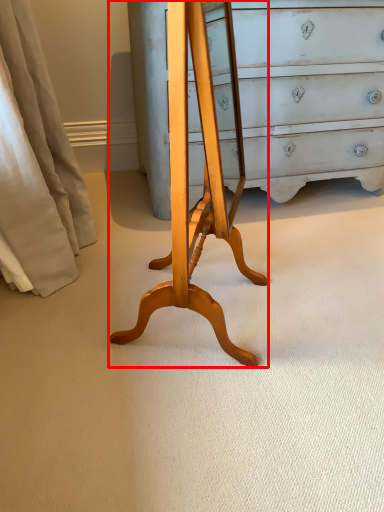
Question: In this image, where is changing table (annotated by the red box) located relative to curtain?

Choices:
 (A) left
 (B) right

Answer: (B)